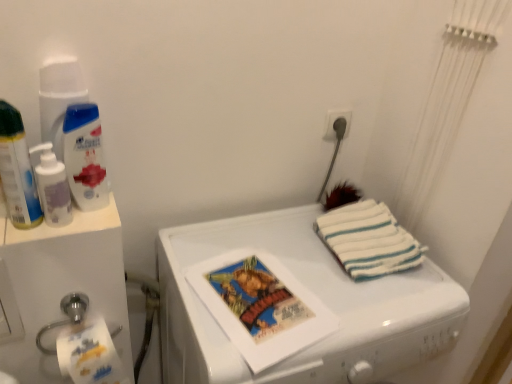
Question: Is white glossy shampoo at upper left, which is the first cleaning product in right-to-left order, not close to white glossy washing machine at center?

Choices:
 (A) no
 (B) yes

Answer: (A)

Question: Is white glossy shampoo at upper left, acting as the 2th cleaning product starting from the left, turned away from white glossy washing machine at center?

Choices:
 (A) yes
 (B) no

Answer: (B)

Question: Is white glossy shampoo at upper left, which is the first cleaning product in right-to-left order, bigger than white glossy washing machine at center?

Choices:
 (A) yes
 (B) no

Answer: (B)

Question: Does white glossy shampoo at upper left, which is the first cleaning product in right-to-left order, have a lesser height compared to white glossy washing machine at center?

Choices:
 (A) no
 (B) yes

Answer: (B)

Question: From a real-world perspective, is white glossy shampoo at upper left, which is the first cleaning product in right-to-left order, below white glossy washing machine at center?

Choices:
 (A) no
 (B) yes

Answer: (A)

Question: From the image's perspective, does white glossy shampoo at upper left, which is the first cleaning product in right-to-left order, appear lower than white glossy washing machine at center?

Choices:
 (A) yes
 (B) no

Answer: (B)

Question: From the image's perspective, is white glossy shampoo at upper left, acting as the 2th cleaning product starting from the left, on top of white plastic water cooler at left?

Choices:
 (A) yes
 (B) no

Answer: (A)

Question: Is white glossy shampoo at upper left, which is the first cleaning product in right-to-left order, thinner than white plastic water cooler at left?

Choices:
 (A) yes
 (B) no

Answer: (A)

Question: From a real-world perspective, is white glossy shampoo at upper left, which is the first cleaning product in right-to-left order, beneath white plastic water cooler at left?

Choices:
 (A) no
 (B) yes

Answer: (A)

Question: Is white glossy shampoo at upper left, which is the first cleaning product in right-to-left order, facing away from white plastic water cooler at left?

Choices:
 (A) no
 (B) yes

Answer: (A)

Question: Does white glossy shampoo at upper left, which is the first cleaning product in right-to-left order, come in front of white plastic water cooler at left?

Choices:
 (A) yes
 (B) no

Answer: (B)

Question: From a real-world perspective, is white glossy shampoo at upper left, acting as the 2th cleaning product starting from the left, positioned over white plastic water cooler at left based on gravity?

Choices:
 (A) no
 (B) yes

Answer: (B)

Question: Is white striped towel at right surrounded by white glossy shampoo at upper left, which is the first cleaning product in right-to-left order?

Choices:
 (A) no
 (B) yes

Answer: (A)